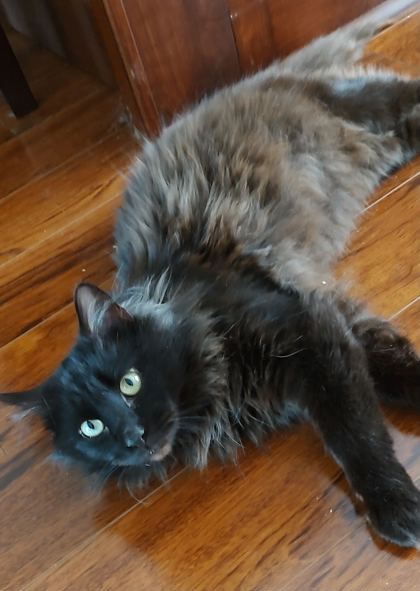
Find the location of `wooden wall`. wooden wall is located at coordinates (170, 41), (85, 34).